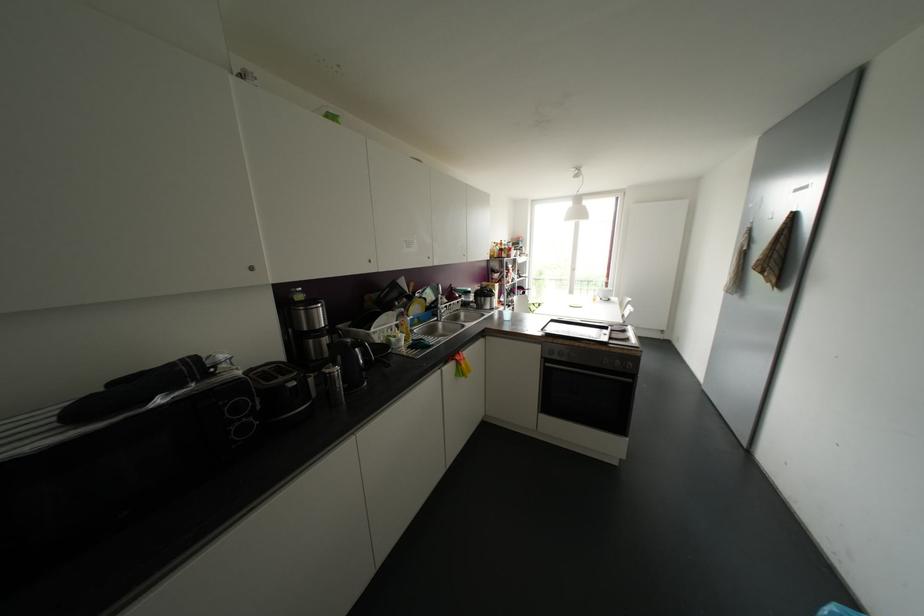
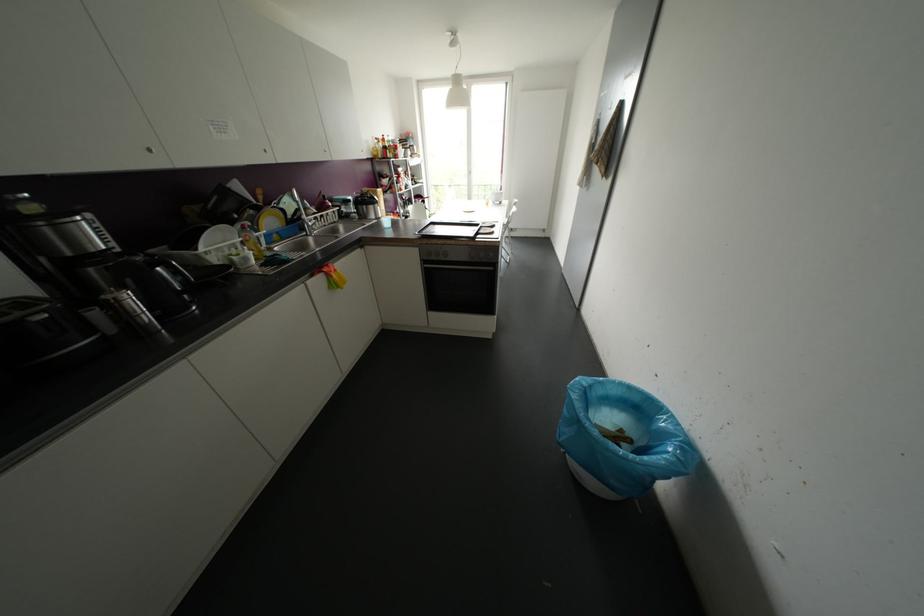
Question: Which direction would the cameraman need to move to produce the second image? Reply with the corresponding letter.

Choices:
 (A) Left
 (B) Right
 (C) Forward
 (D) Backward

Answer: (B)